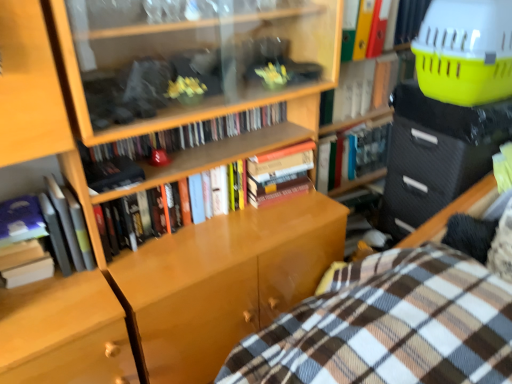
Question: Is hardcover book at upper center, the seventh book in the left-to-right sequence, aimed at black textured drawer at right?

Choices:
 (A) yes
 (B) no

Answer: (B)

Question: Is hardcover book at upper center, positioned as the 2th book in right-to-left order, turned away from black textured drawer at right?

Choices:
 (A) no
 (B) yes

Answer: (A)

Question: Is hardcover book at upper center, the seventh book in the left-to-right sequence, not close to black textured drawer at right?

Choices:
 (A) yes
 (B) no

Answer: (B)

Question: Is hardcover book at upper center, the seventh book in the left-to-right sequence, behind black textured drawer at right?

Choices:
 (A) yes
 (B) no

Answer: (A)

Question: From a real-world perspective, does hardcover book at upper center, the seventh book in the left-to-right sequence, sit lower than black textured drawer at right?

Choices:
 (A) no
 (B) yes

Answer: (A)

Question: Is hardcover book at upper center, positioned as the 2th book in right-to-left order, to the right of black textured drawer at right from the viewer's perspective?

Choices:
 (A) no
 (B) yes

Answer: (A)

Question: Is the depth of hardcover book at left, acting as the first book starting from the left, less than that of hardcover book at upper center, positioned as the 2th book in right-to-left order?

Choices:
 (A) no
 (B) yes

Answer: (B)

Question: Considering the relative sizes of hardcover book at left, acting as the first book starting from the left, and hardcover book at upper center, the seventh book in the left-to-right sequence, in the image provided, is hardcover book at left, acting as the first book starting from the left, shorter than hardcover book at upper center, the seventh book in the left-to-right sequence,?

Choices:
 (A) yes
 (B) no

Answer: (A)

Question: From a real-world perspective, is hardcover book at left, acting as the first book starting from the left, on hardcover book at upper center, positioned as the 2th book in right-to-left order?

Choices:
 (A) yes
 (B) no

Answer: (B)

Question: Is hardcover book at left, the eighth book from the right, looking in the opposite direction of hardcover book at upper center, positioned as the 2th book in right-to-left order?

Choices:
 (A) no
 (B) yes

Answer: (A)

Question: Is hardcover book at left, the eighth book from the right, far away from hardcover book at upper center, positioned as the 2th book in right-to-left order?

Choices:
 (A) no
 (B) yes

Answer: (B)

Question: From the image's perspective, is hardcover book at left, acting as the first book starting from the left, under hardcover book at upper center, positioned as the 2th book in right-to-left order?

Choices:
 (A) no
 (B) yes

Answer: (B)

Question: Is hardcover book at center, marked as the 6th book in a right-to-left arrangement, completely or partially outside of hardcover book at left, which is the second book in left-to-right order?

Choices:
 (A) no
 (B) yes

Answer: (B)